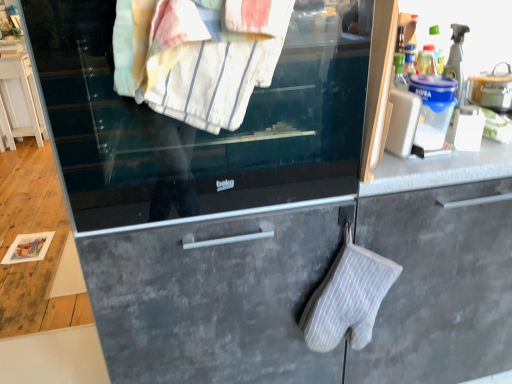
Question: Is white striped towel at upper center directly adjacent to white striped oven mitt at lower center?

Choices:
 (A) no
 (B) yes

Answer: (A)

Question: From a real-world perspective, is white striped towel at upper center under white striped oven mitt at lower center?

Choices:
 (A) yes
 (B) no

Answer: (B)

Question: From a real-world perspective, is white striped towel at upper center on white striped oven mitt at lower center?

Choices:
 (A) no
 (B) yes

Answer: (B)

Question: Would you say white striped towel at upper center is a long distance from white striped oven mitt at lower center?

Choices:
 (A) no
 (B) yes

Answer: (A)

Question: Is white striped towel at upper center positioned with its back to white striped oven mitt at lower center?

Choices:
 (A) yes
 (B) no

Answer: (B)

Question: Can you confirm if white striped towel at upper center is positioned to the left of white striped oven mitt at lower center?

Choices:
 (A) no
 (B) yes

Answer: (B)

Question: Considering the relative sizes of white striped oven mitt at lower center and white plastic phone at upper right in the image provided, is white striped oven mitt at lower center wider than white plastic phone at upper right?

Choices:
 (A) yes
 (B) no

Answer: (A)

Question: Is white striped oven mitt at lower center to the left of white plastic phone at upper right from the viewer's perspective?

Choices:
 (A) no
 (B) yes

Answer: (B)

Question: From the image's perspective, does white striped oven mitt at lower center appear higher than white plastic phone at upper right?

Choices:
 (A) no
 (B) yes

Answer: (A)

Question: From the image's perspective, is white striped oven mitt at lower center located beneath white plastic phone at upper right?

Choices:
 (A) yes
 (B) no

Answer: (A)

Question: From a real-world perspective, is white striped oven mitt at lower center positioned under white plastic phone at upper right based on gravity?

Choices:
 (A) yes
 (B) no

Answer: (A)

Question: Is white striped oven mitt at lower center oriented away from white plastic phone at upper right?

Choices:
 (A) yes
 (B) no

Answer: (B)

Question: From the image's perspective, would you say clear glass oven door at center is positioned over white plastic phone at upper right?

Choices:
 (A) yes
 (B) no

Answer: (A)